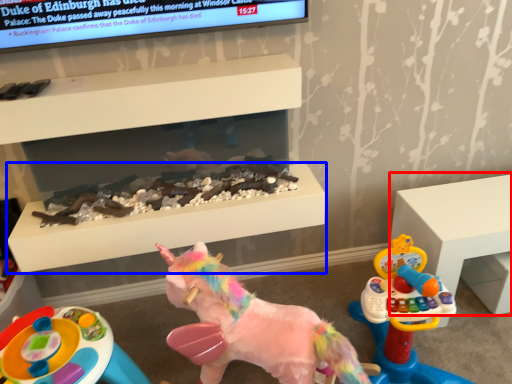
Question: Among these objects, which one is nearest to the camera, furniture (highlighted by a red box) or table (highlighted by a blue box)?

Choices:
 (A) furniture
 (B) table

Answer: (B)